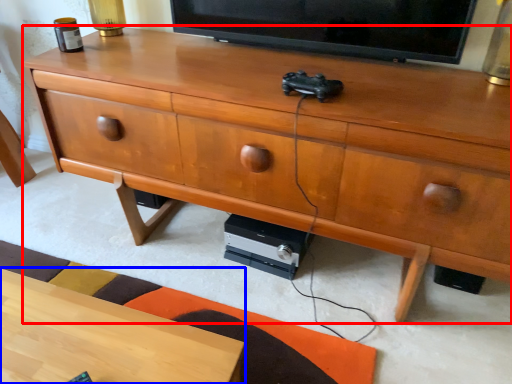
Question: Which object appears farthest to the camera in this image, chest of drawers (highlighted by a red box) or desk (highlighted by a blue box)?

Choices:
 (A) chest of drawers
 (B) desk

Answer: (A)